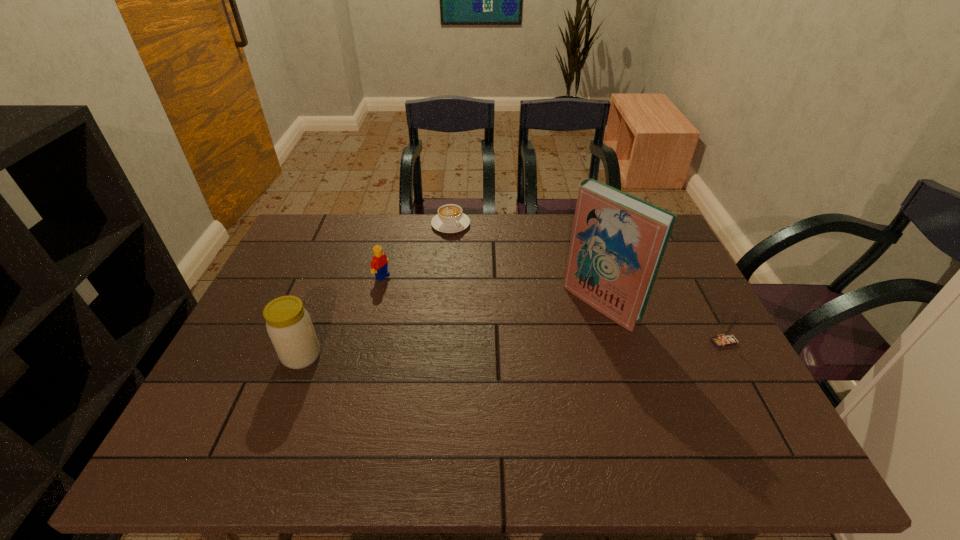
This screenshot has height=540, width=960. Identify the location of the leftmost object. (289, 326).

Where is `jar`? jar is located at coordinates (289, 326).

In order to click on matchbox in this screenshot , I will do `click(727, 340)`.

Find the location of a particular element. the second object from left to right is located at coordinates (379, 262).

The height and width of the screenshot is (540, 960). What are the coordinates of `cappuccino` in the screenshot? It's located at (450, 219).

Identify the location of the farthest object. The image size is (960, 540). (450, 219).

Locate an element on the screen. This screenshot has width=960, height=540. the tallest object is located at coordinates (618, 241).

This screenshot has width=960, height=540. Find the location of `hardback book`. hardback book is located at coordinates (618, 241).

The height and width of the screenshot is (540, 960). What are the coordinates of `vacant area situated on the back of the jar` in the screenshot? It's located at point(332,277).

What are the coordinates of `free space located 0.110m on the back of the matchbox` in the screenshot? It's located at (704, 305).